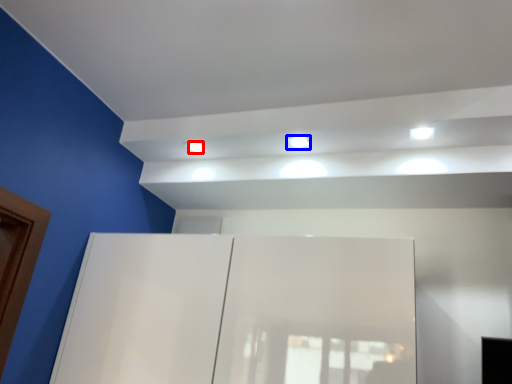
Question: Among these objects, which one is nearest to the camera, dot (highlighted by a red box) or light (highlighted by a blue box)?

Choices:
 (A) dot
 (B) light

Answer: (B)